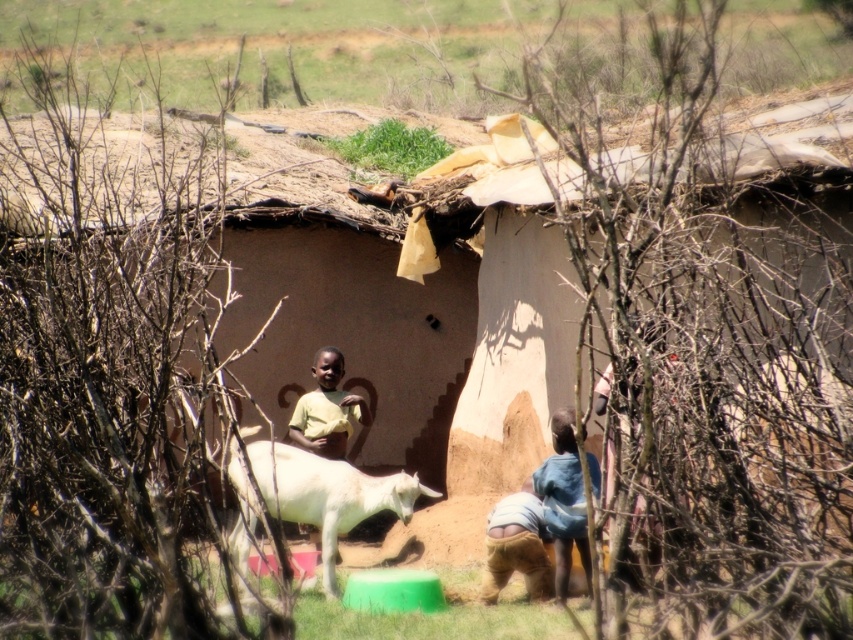
Does white matte goat at center have a greater height compared to yellow matte shirt at center?

Correct, white matte goat at center is much taller as yellow matte shirt at center.

Does white matte goat at center appear under yellow matte shirt at center?

Indeed, white matte goat at center is positioned under yellow matte shirt at center.

Does point (230, 472) come in front of point (341, 420)?

Yes, it is.

Find the location of `white matte goat at center`. white matte goat at center is located at coordinates (328, 493).

Can you confirm if white matte goat at center is positioned to the right of blue denim skirt at lower right?

Incorrect, white matte goat at center is not on the right side of blue denim skirt at lower right.

Can you confirm if white matte goat at center is smaller than blue denim skirt at lower right?

Incorrect, white matte goat at center is not smaller in size than blue denim skirt at lower right.

Where is `white matte goat at center`? white matte goat at center is located at coordinates (328, 493).

Does blue denim skirt at lower right come behind yellow matte shirt at center?

No.

Does blue denim skirt at lower right have a larger size compared to yellow matte shirt at center?

Yes, blue denim skirt at lower right is bigger than yellow matte shirt at center.

Find the location of a particular element. The width and height of the screenshot is (853, 640). blue denim skirt at lower right is located at coordinates (564, 500).